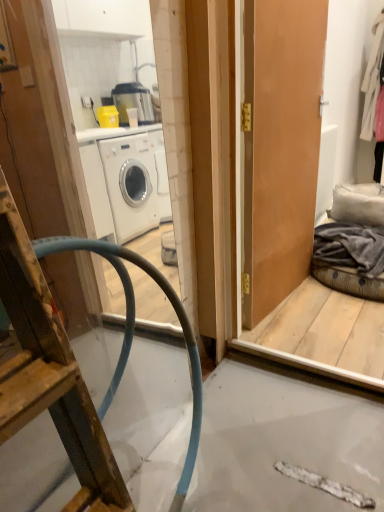
Where is `vacant space in front of matte brown door at center`? vacant space in front of matte brown door at center is located at coordinates (307, 325).